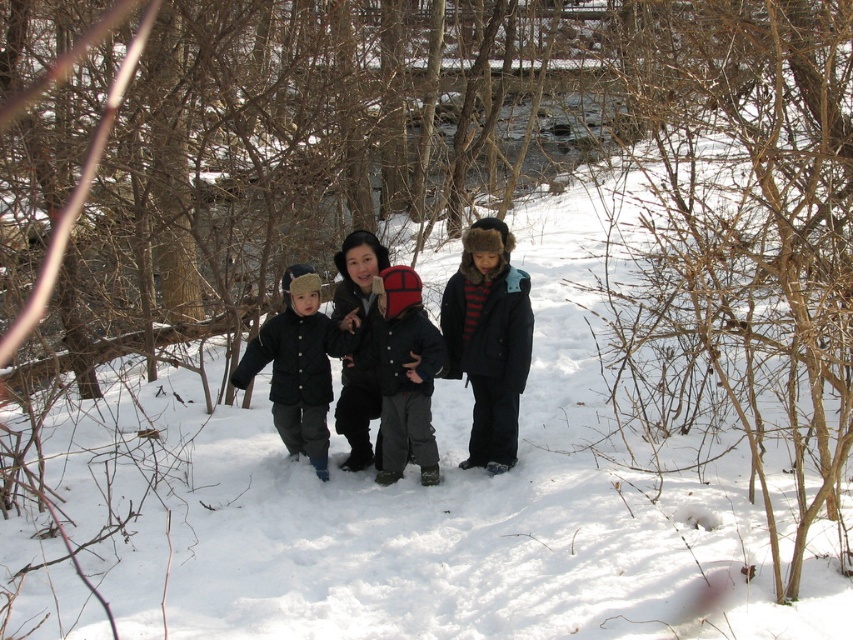
Question: Is the position of matte black coat at center less distant than that of red knit hat at center?

Choices:
 (A) yes
 (B) no

Answer: (B)

Question: Is matte black coat at center behind red knit hat at center?

Choices:
 (A) yes
 (B) no

Answer: (A)

Question: Which point is closer to the camera?

Choices:
 (A) (434, 333)
 (B) (491, 365)

Answer: (A)

Question: Can you confirm if striped wool sweater at center is bigger than matte black coat at center?

Choices:
 (A) no
 (B) yes

Answer: (B)

Question: Which of the following is the closest to the observer?

Choices:
 (A) (397, 312)
 (B) (515, 381)

Answer: (A)

Question: Which of the following is the closest to the observer?

Choices:
 (A) (413, 428)
 (B) (488, 244)

Answer: (B)